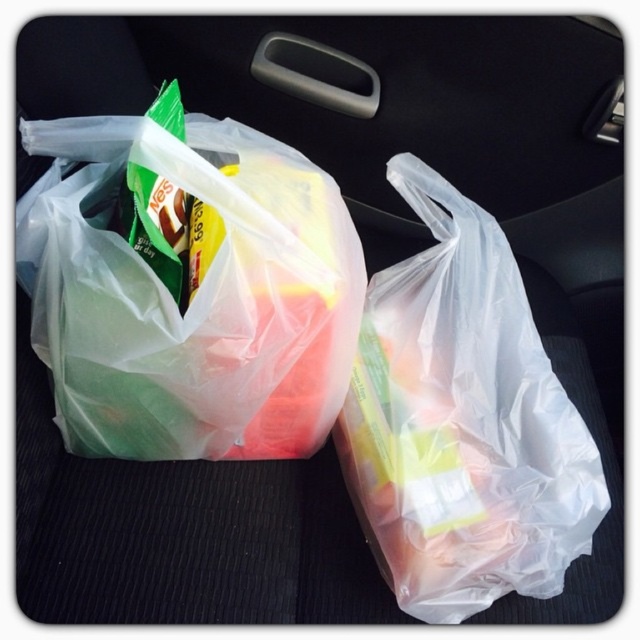
You are trying to find the transparent plastic bag at center in the car seat. Which direction should you look relative to the translucent plastic bag at left?

The transparent plastic bag at center is below the translucent plastic bag at left, so you should look downward from the translucent plastic bag at left to find it.

You are sitting in the back seat of a car and notice two points marked in the image. The first point is at coordinates point (257, 157) and the second is at point (396, 394). Which point is closer to you?

Point (257, 157) is closer to the camera than point (396, 394), so the first point is closer to you.